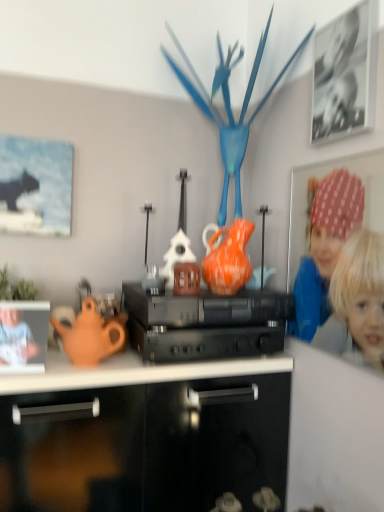
Question: Which is correct: black plastic stereo at center is inside orange glazed earthenware teapot at center, or outside of it?

Choices:
 (A) outside
 (B) inside

Answer: (A)

Question: From the image's perspective, is black plastic stereo at center positioned above or below orange glazed earthenware teapot at center?

Choices:
 (A) above
 (B) below

Answer: (B)

Question: Based on their relative distances, which object is farther from the matte orange teapot at left?

Choices:
 (A) matte orange teapot at left, positioned as the second person in right-to-left order
 (B) orange glazed earthenware teapot at center
 (C) black plastic stereo at center
 (D) black matte picture frame at upper right, which appears as the 1th picture frame when viewed from the front
 (E) polka dot fabric at upper right, arranged as the first person when viewed from the right

Answer: (D)

Question: Considering the real-world distances, which object is closest to the matte orange teapot at left?

Choices:
 (A) black matte picture frame at upper right, which appears as the 1th picture frame when viewed from the front
 (B) blue glossy bird at center
 (C) orange glazed earthenware teapot at center
 (D) black plastic stereo at center
 (E) polka dot fabric at upper right, acting as the second person starting from the left

Answer: (D)